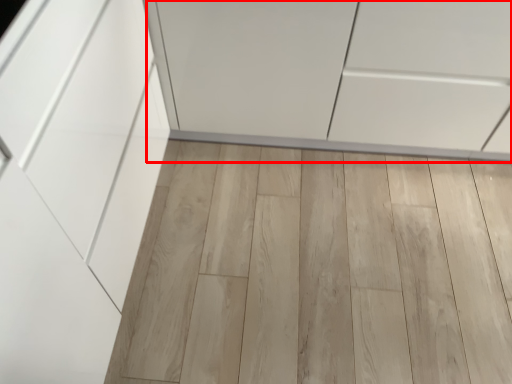
Question: From the image's perspective, considering the relative positions of cabinetry (annotated by the red box) and plank in the image provided, where is cabinetry (annotated by the red box) located with respect to the staircase?

Choices:
 (A) below
 (B) above

Answer: (B)